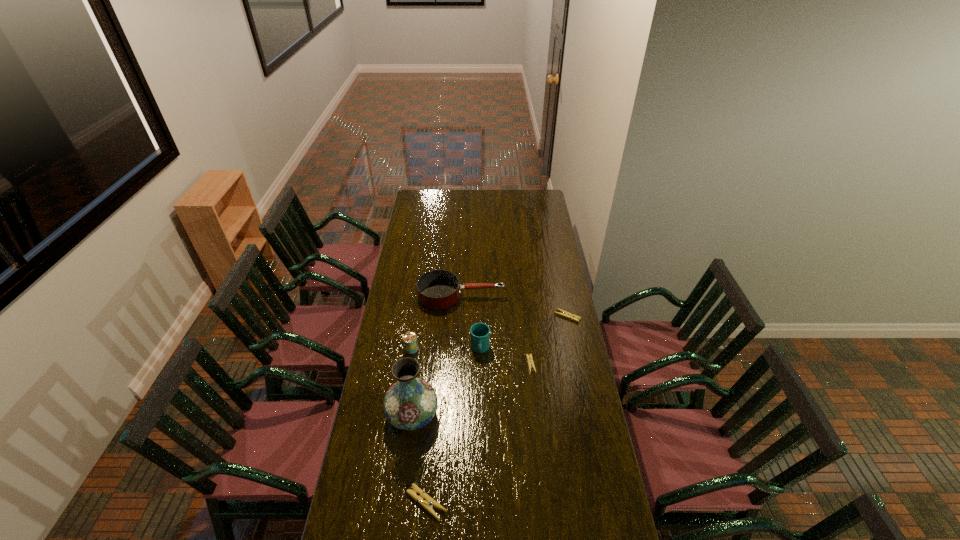
At what (x,y) coordinates should I click in order to perform the action: click on vacant position for inserting another clothespin evenly. Please return your answer as a coordinate pair (x, y). This screenshot has height=540, width=960. Looking at the image, I should click on coord(486,425).